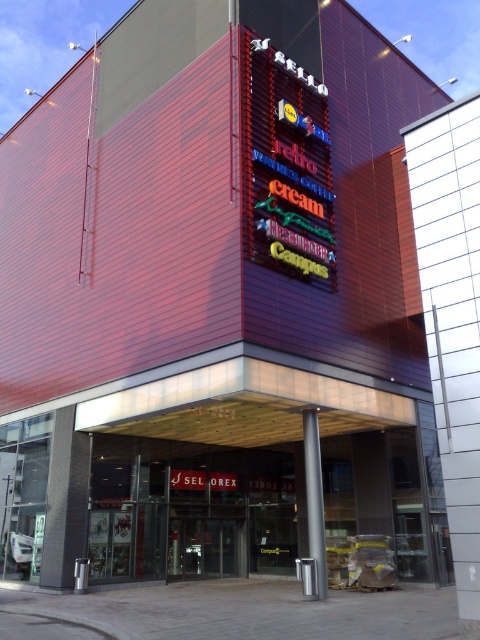
Question: Can you confirm if neon signboard at center is positioned to the left of transparent glass doors at center?

Choices:
 (A) no
 (B) yes

Answer: (A)

Question: Which point appears farthest from the camera in this image?

Choices:
 (A) (292, 160)
 (B) (197, 573)

Answer: (B)

Question: Which of the following is the closest to the observer?

Choices:
 (A) (279, 76)
 (B) (238, 561)

Answer: (A)

Question: From the image, what is the correct spatial relationship of neon signboard at center in relation to transparent glass doors at center?

Choices:
 (A) right
 (B) left

Answer: (A)

Question: Can you confirm if neon signboard at center is positioned to the left of transparent glass doors at center?

Choices:
 (A) no
 (B) yes

Answer: (A)

Question: Which point is farther to the camera?

Choices:
 (A) neon signboard at center
 (B) transparent glass doors at center

Answer: (B)